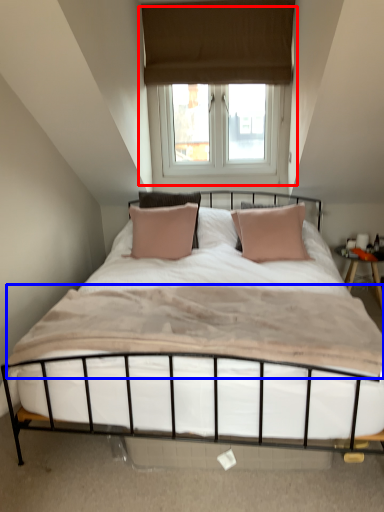
Question: Which of the following is the closest to the observer, window (highlighted by a red box) or mattress (highlighted by a blue box)?

Choices:
 (A) window
 (B) mattress

Answer: (B)